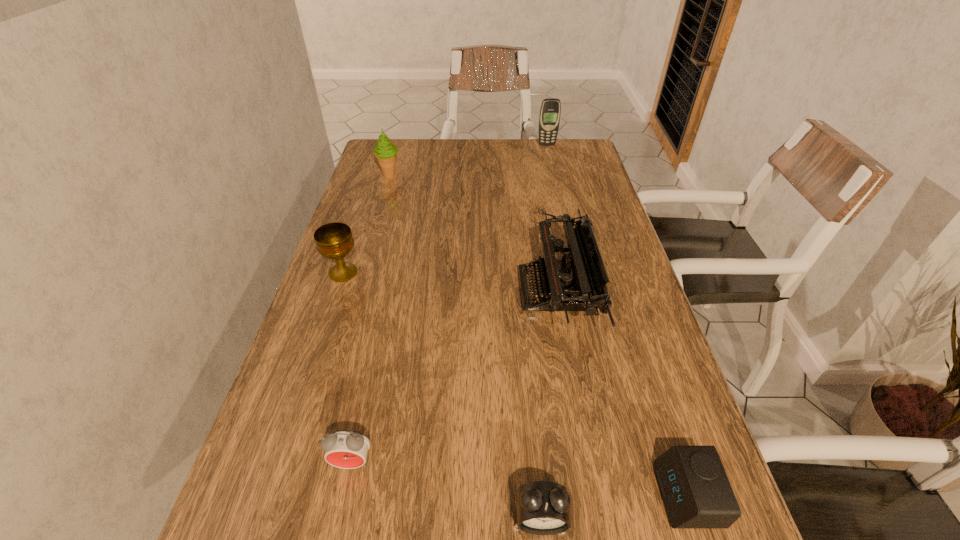
You are a GUI agent. You are given a task and a screenshot of the screen. Output one action in this format:
    pyautogui.click(x=<x>, y=<y>)
    Task: Click on the farthest object
    Image resolution: width=960 pixels, height=540 pixels.
    Given the screenshot: What is the action you would take?
    pyautogui.click(x=550, y=110)

Locate an element on the screen. This screenshot has height=540, width=960. the second farthest object is located at coordinates (385, 152).

You are a GUI agent. You are given a task and a screenshot of the screen. Output one action in this format:
    pyautogui.click(x=<x>, y=<y>)
    Task: Click on the typewriter
    Image resolution: width=960 pixels, height=540 pixels.
    Given the screenshot: What is the action you would take?
    pyautogui.click(x=577, y=282)

This screenshot has height=540, width=960. What are the coordinates of `chalice` in the screenshot? It's located at (334, 240).

You are a GUI agent. You are given a task and a screenshot of the screen. Output one action in this format:
    pyautogui.click(x=<x>, y=<y>)
    Task: Click on the leftmost alarm clock
    Image resolution: width=960 pixels, height=540 pixels.
    Given the screenshot: What is the action you would take?
    point(347,449)

This screenshot has height=540, width=960. Identify the location of the second alarm clock from right to left. (542, 507).

Where is `the shortest alarm clock`? the shortest alarm clock is located at coordinates (693, 484).

This screenshot has width=960, height=540. In order to click on the rightmost alarm clock in this screenshot , I will do `click(693, 484)`.

At what (x,y) coordinates should I click in order to perform the action: click on free region located on the screen of the farthest object. Please return your answer as a coordinate pair (x, y). Looking at the image, I should click on (551, 160).

You are a GUI agent. You are given a task and a screenshot of the screen. Output one action in this format:
    pyautogui.click(x=<x>, y=<y>)
    Task: Click on the free spot located 0.090m on the right of the sixth nearest object
    This screenshot has width=960, height=540.
    Given the screenshot: What is the action you would take?
    pyautogui.click(x=428, y=176)